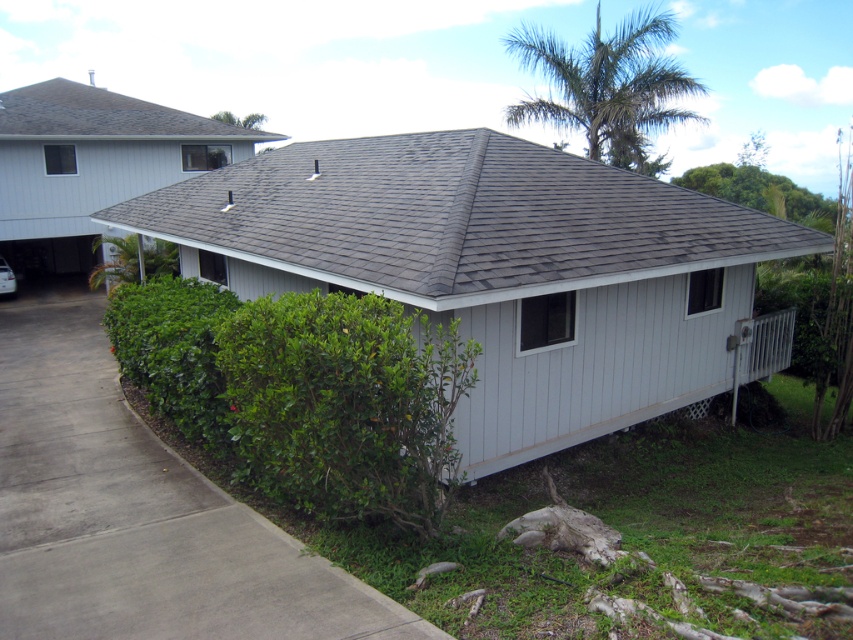
You are a delivery person arriving at this house. You need to park your vehicle on the gray concrete driveway at lower left. However, your vehicle is as big as the gray shingles at center. Will there be enough space to park?

The gray shingles at center is bigger than the gray concrete driveway at lower left, so the driveway is smaller than the vehicle. Therefore, there won not be enough space to park.

You are standing at the point closest to the house and want to walk to the other point. Which point should you head towards, the point at coordinate (73, 486) or the point at coordinate (45, 120)?

You should head towards the point at coordinate (45, 120) because point (73, 486) is in front of point (45, 120), meaning the latter is behind and further away from the house.